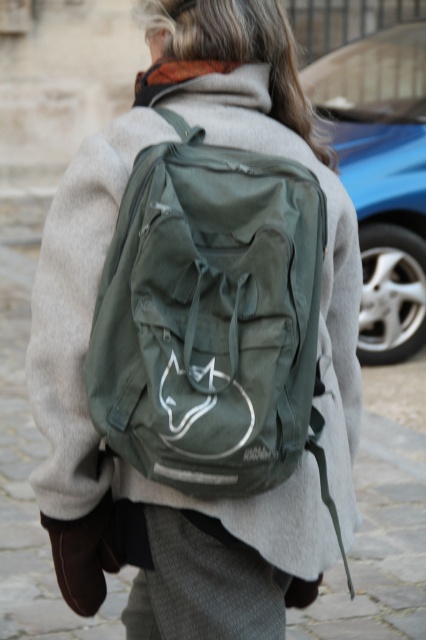
You are a delivery person who needs to place the olive green fabric backpack at center into the trunk of the blue metallic car at upper right. Based on their sizes, will the backpack fit vertically in the trunk?

The olive green fabric backpack at center is not as tall as blue metallic car at upper right, so it should fit vertically in the trunk.

You are standing in an urban plaza and want to take a photo of the backpack with the fox logo. The backpack has two points marked on it. One is at point (138, 330) and the other at point (359, 118). Which point is closer to the camera so that it appears larger in the photo?

Point (138, 330) is closer to the camera than point (359, 118), so it will appear larger in the photo.